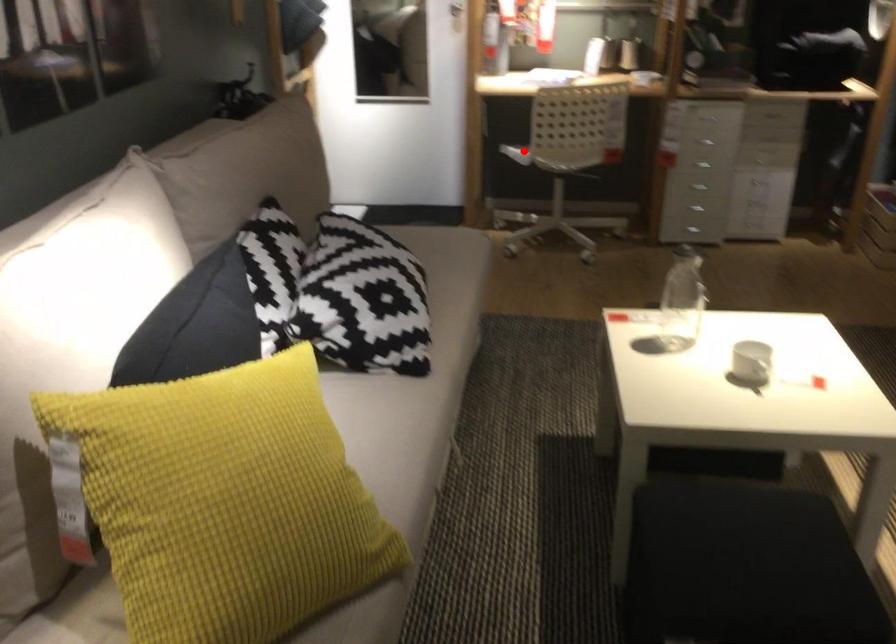
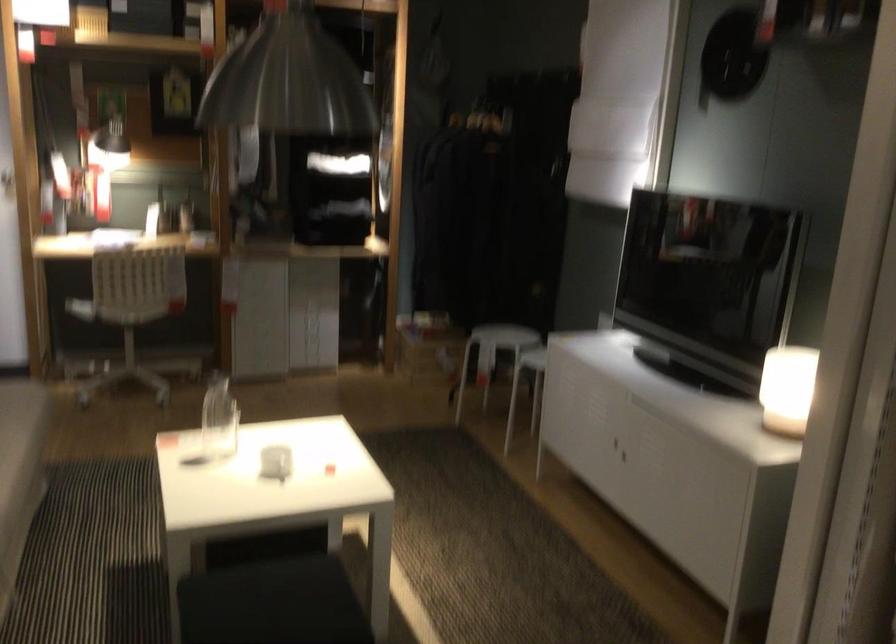
Find the pixel in the second image that matches the highlighted location in the first image.

(80, 308)